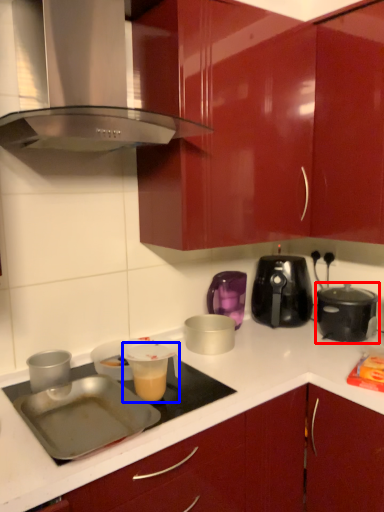
Question: Which point is closer to the camera, kitchen appliance (highlighted by a red box) or appliance (highlighted by a blue box)?

Choices:
 (A) kitchen appliance
 (B) appliance

Answer: (B)